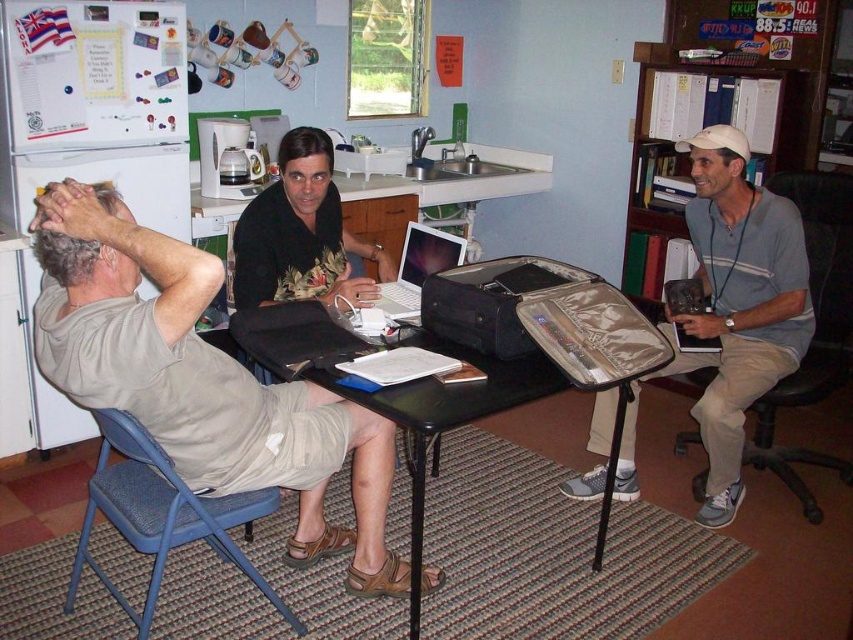
You are standing in the room and want to reach a point that is exactly 2.64 meters away from your current position. According to the scene, is there a specific location marked by the point at coordinates (741, 413) where you can go?

Yes, the point at coordinates (741, 413) is exactly 2.64 meters away from the camera, so you can go to that location to reach the desired distance.

You are trying to place a white matte cap at upper right on top of the black plastic table at center. Based on the scene description, will the cap fit on the table?

The black plastic table at center is much taller than the white matte cap at upper right, so the cap can be placed on the table since height isn

You are a delivery person who needs to place a small package on the table where the silver metallic laptop at center is located. However, there is a light brown leather sandal at lower center in the way. Can you place the package on the table without moving the sandal?

The light brown leather sandal at lower center is located below the silver metallic laptop at center, meaning it is not on the table. Therefore, you can safely place the package on the table where the silver metallic laptop at center is located without needing to move the sandal.